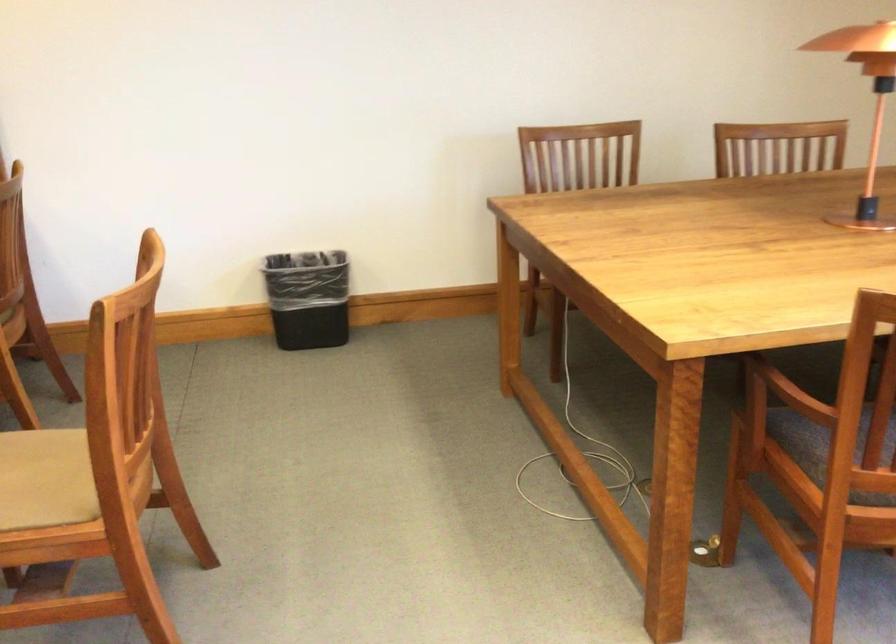
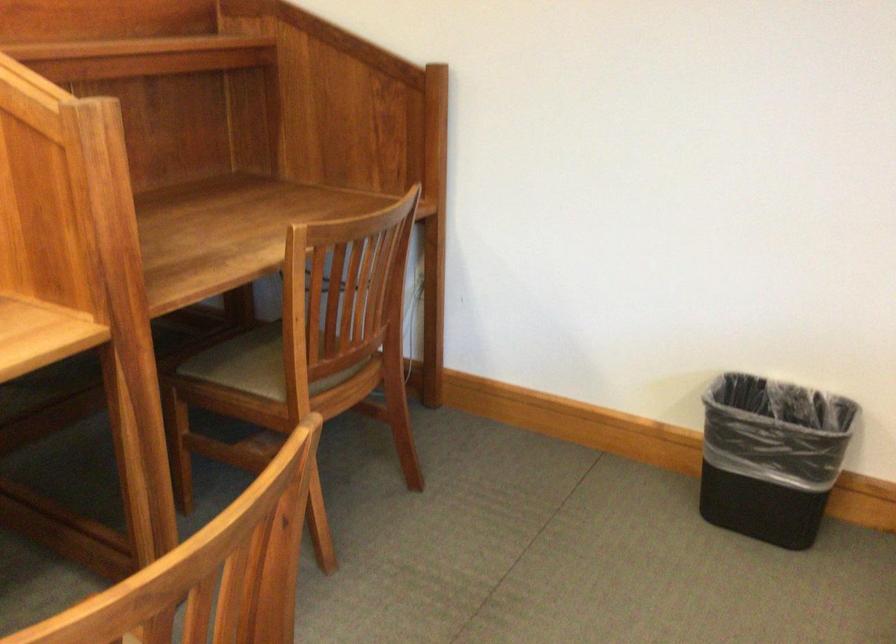
Where in the second image is the point corresponding to pixel 307 292 from the first image?

(771, 456)